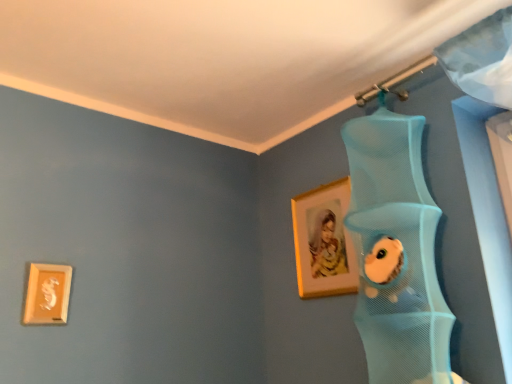
Question: In terms of height, does matte gold picture frame at upper center, the 2th picture frame viewed from the left, look taller or shorter compared to matte gold picture frame at lower left, which is the first picture frame from left to right?

Choices:
 (A) tall
 (B) short

Answer: (A)

Question: Based on their positions, is matte gold picture frame at upper center, the first picture frame when ordered from back to front, located to the left or right of matte gold picture frame at lower left, arranged as the second picture frame when viewed from the right?

Choices:
 (A) left
 (B) right

Answer: (B)

Question: Choose the correct answer: Is matte gold picture frame at upper center, acting as the 1th picture frame starting from the right, inside matte gold picture frame at lower left, which is the first picture frame from left to right, or outside it?

Choices:
 (A) inside
 (B) outside

Answer: (B)

Question: From the image's perspective, is matte gold picture frame at lower left, arranged as the second picture frame when viewed from the right, positioned above or below matte gold picture frame at upper center, the 2th picture frame viewed from the left?

Choices:
 (A) below
 (B) above

Answer: (A)

Question: From a real-world perspective, is matte gold picture frame at lower left, which is the first picture frame from left to right, positioned above or below matte gold picture frame at upper center, the first picture frame when ordered from back to front?

Choices:
 (A) below
 (B) above

Answer: (A)

Question: Is matte gold picture frame at lower left, which is the first picture frame from left to right, spatially inside matte gold picture frame at upper center, acting as the 1th picture frame starting from the right, or outside of it?

Choices:
 (A) outside
 (B) inside

Answer: (A)

Question: Considering their positions, is matte gold picture frame at lower left, which is counted as the 1th picture frame, starting from the front, located in front of or behind matte gold picture frame at upper center, the first picture frame when ordered from back to front?

Choices:
 (A) front
 (B) behind

Answer: (A)